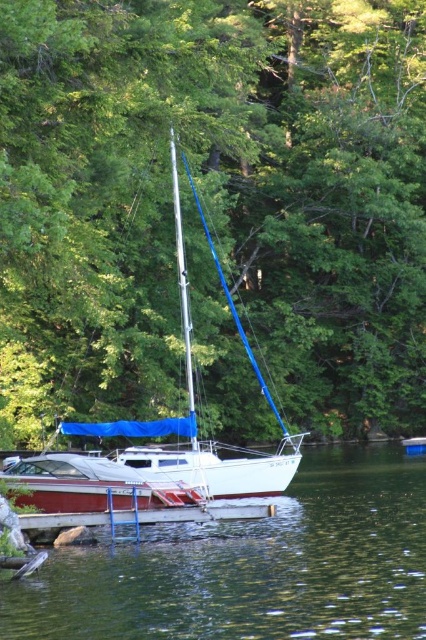
You are standing on the brown wooden dock at lower center and want to reach the green liquid water at lower center. Which direction should you move to get to the water?

The green liquid water at lower center is in front of the brown wooden dock at lower center, so you should move forward from the dock to reach the water.

You are standing at the edge of the lake and see two points marked on the image. The first point is at coordinates point (293,586) and the second is at point (221,516). Which point is closer to you?

Point (293,586) is in front of point (221,516), so the first point is closer to you.